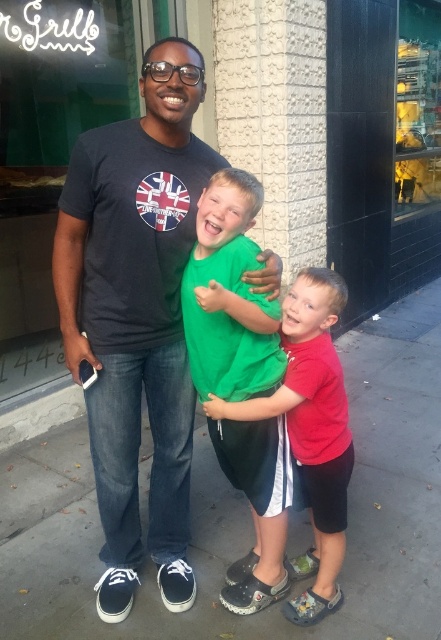
Who is taller, green matte shirt at center or red matte shirt at center?

With more height is green matte shirt at center.

Measure the distance between green matte shirt at center and camera.

4.92 feet

Find the location of a particular element. Image resolution: width=441 pixels, height=640 pixels. green matte shirt at center is located at coordinates (228, 296).

Does gray concrete sidewalk at center lie in front of green matte shirt at center?

No, it is not.

Can you confirm if gray concrete sidewalk at center is shorter than green matte shirt at center?

Yes, gray concrete sidewalk at center is shorter than green matte shirt at center.

Describe the element at coordinates (247, 513) in the screenshot. I see `gray concrete sidewalk at center` at that location.

This screenshot has width=441, height=640. In order to click on gray concrete sidewalk at center in this screenshot , I will do `click(247, 513)`.

Does gray concrete sidewalk at center have a lesser width compared to red matte shirt at center?

In fact, gray concrete sidewalk at center might be wider than red matte shirt at center.

At what (x,y) coordinates should I click in order to perform the action: click on gray concrete sidewalk at center. Please return your answer as a coordinate pair (x, y). The width and height of the screenshot is (441, 640). Looking at the image, I should click on (247, 513).